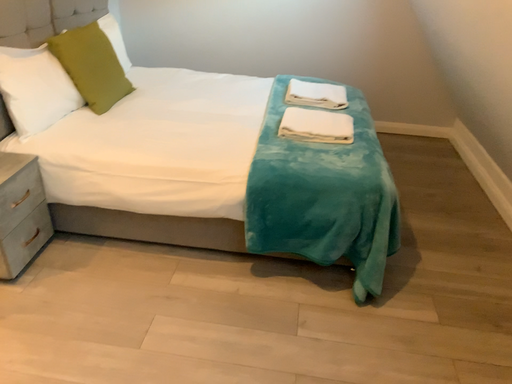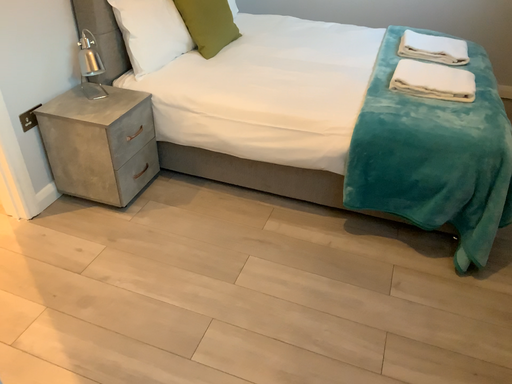
Question: Which way did the camera rotate in the video?

Choices:
 (A) rotated right
 (B) rotated left

Answer: (B)